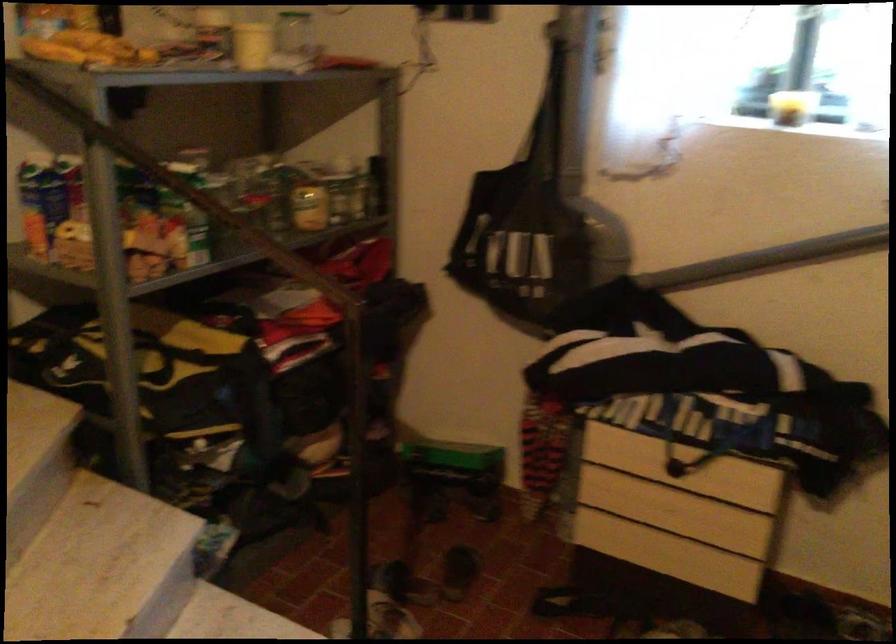
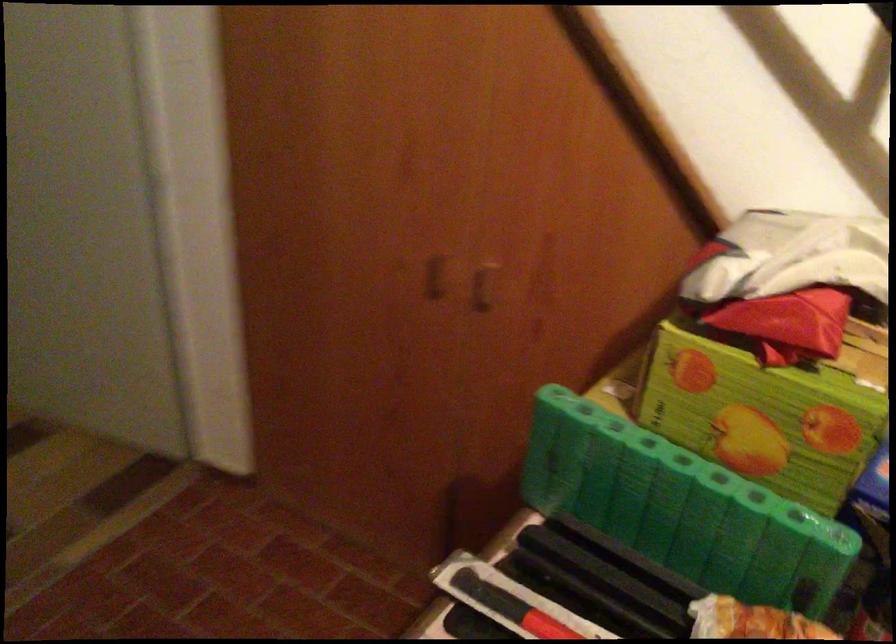
First-person continuous shooting, in which direction is the camera rotating?

The rotation direction of the camera is left-down.